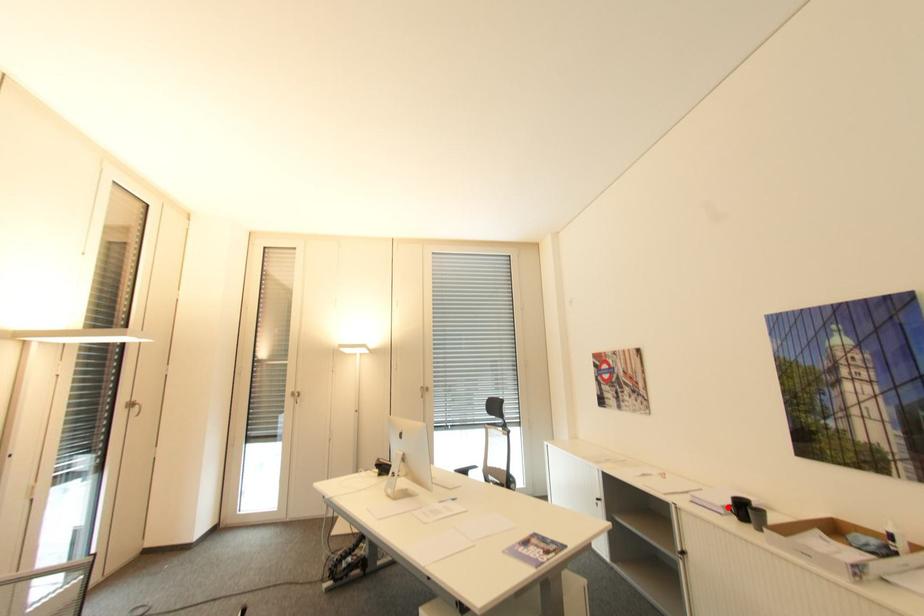
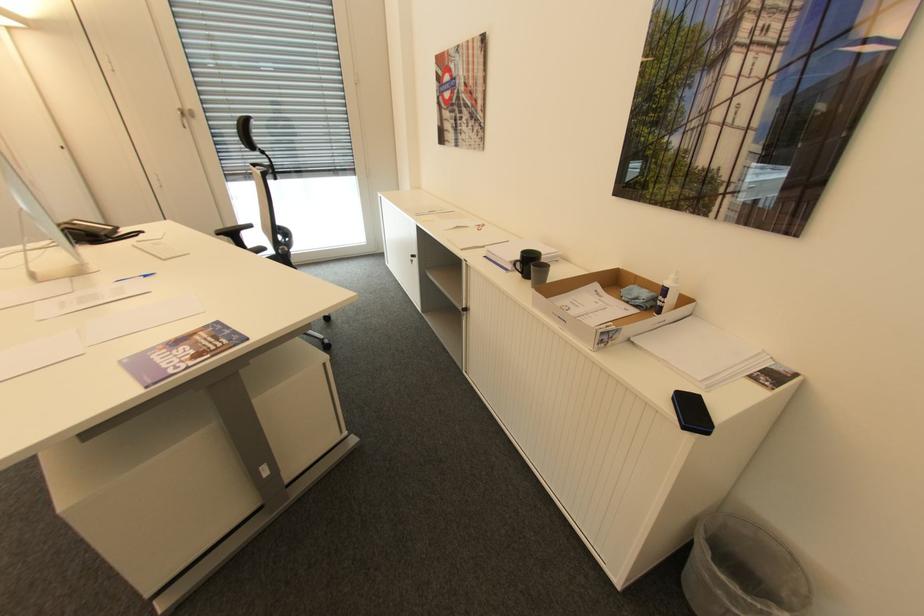
The point at the highlighted location is marked in the first image. Where is the corresponding point in the second image?

(516, 262)